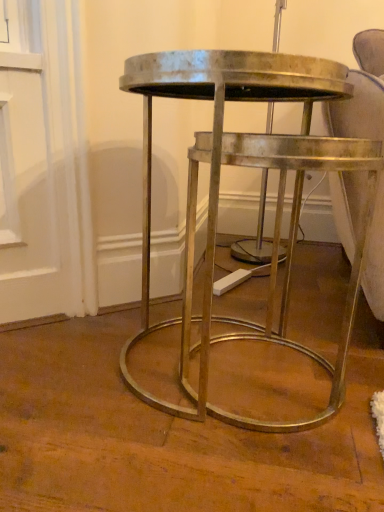
At what (x,y) coordinates should I click in order to perform the action: click on shiny metallic stool at center. Please return your answer as a coordinate pair (x, y). The image size is (384, 512). Looking at the image, I should click on (218, 196).

Measure the distance between shiny metallic stool at center and camera.

shiny metallic stool at center and camera are 25.86 inches apart from each other.

What do you see at coordinates (218, 196) in the screenshot? Image resolution: width=384 pixels, height=512 pixels. I see `shiny metallic stool at center` at bounding box center [218, 196].

Locate an element on the screen. The height and width of the screenshot is (512, 384). shiny metallic stool at center is located at coordinates click(218, 196).